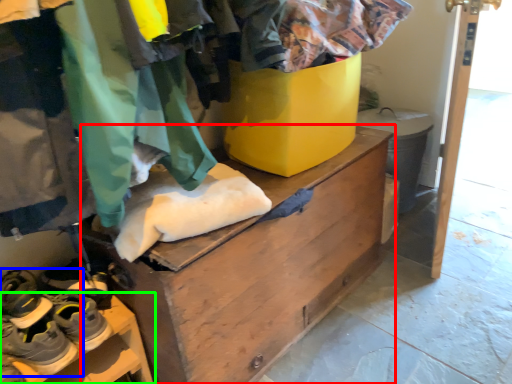
Question: Which object is the closest to the chest of drawers (highlighted by a red box)? Choose among these: footwear (highlighted by a blue box) or furniture (highlighted by a green box).

Choices:
 (A) footwear
 (B) furniture

Answer: (B)